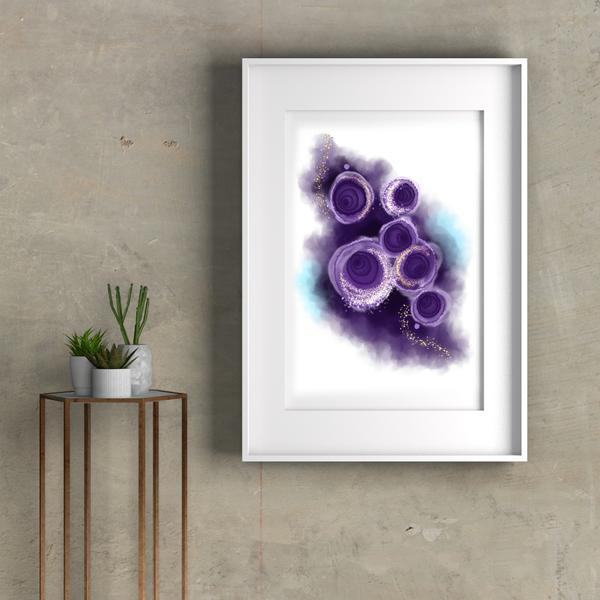
You are a GUI agent. You are given a task and a screenshot of the screen. Output one action in this format:
    pyautogui.click(x=<x>, y=<y>)
    Task: Click on the purple painting
    
    Given the screenshot: What is the action you would take?
    pyautogui.click(x=382, y=262)